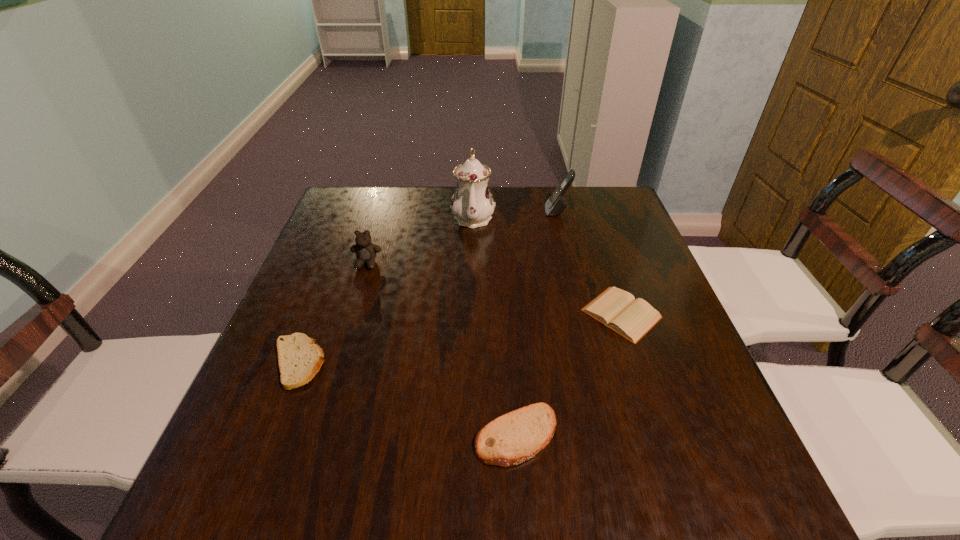
This screenshot has height=540, width=960. Identify the location of vacant area in the image that satisfies the following two spatial constraints: 1. on the front-facing side of the second tallest object; 2. on the face of the teddy bear. tap(570, 264).

Find the location of a particular element. The image size is (960, 540). vacant space that satisfies the following two spatial constraints: 1. on the face of the third farthest object; 2. on the left side of the right pita bread is located at coordinates (315, 435).

The image size is (960, 540). Find the location of `blank area in the image that satisfies the following two spatial constraints: 1. on the front-facing side of the fifth shortest object; 2. on the face of the fourth shortest object`. blank area in the image that satisfies the following two spatial constraints: 1. on the front-facing side of the fifth shortest object; 2. on the face of the fourth shortest object is located at coordinates (570, 264).

Locate an element on the screen. The height and width of the screenshot is (540, 960). free region that satisfies the following two spatial constraints: 1. on the front-facing side of the cellular telephone; 2. on the right side of the diary is located at coordinates (582, 314).

Identify the location of free space that satisfies the following two spatial constraints: 1. on the front-facing side of the fifth shortest object; 2. on the face of the third tallest object. Image resolution: width=960 pixels, height=540 pixels. (570, 264).

Identify the location of free region that satisfies the following two spatial constraints: 1. on the back side of the tallest object; 2. on the left side of the farther pita bread. The width and height of the screenshot is (960, 540). (354, 217).

At what (x,y) coordinates should I click in order to perform the action: click on vacant region that satisfies the following two spatial constraints: 1. on the face of the diary; 2. on the left side of the third tallest object. Please return your answer as a coordinate pair (x, y). This screenshot has width=960, height=540. Looking at the image, I should click on (351, 314).